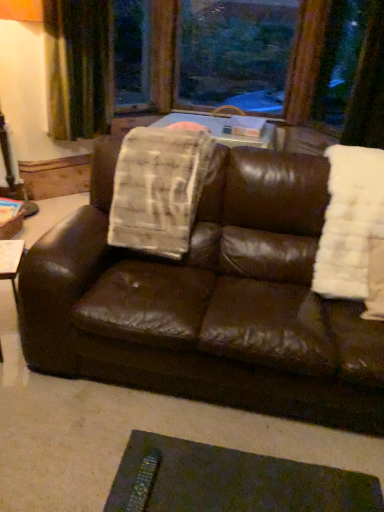
Question: Considering the relative sizes of transparent glass window at upper center, placed as the first window screen when sorted from right to left, and green velvet curtain at upper left in the image provided, is transparent glass window at upper center, placed as the first window screen when sorted from right to left, smaller than green velvet curtain at upper left?

Choices:
 (A) no
 (B) yes

Answer: (A)

Question: Considering the relative positions of transparent glass window at upper center, the second window screen viewed from the left, and green velvet curtain at upper left in the image provided, is transparent glass window at upper center, the second window screen viewed from the left, behind green velvet curtain at upper left?

Choices:
 (A) no
 (B) yes

Answer: (B)

Question: Considering the relative positions of transparent glass window at upper center, placed as the first window screen when sorted from right to left, and green velvet curtain at upper left in the image provided, is transparent glass window at upper center, placed as the first window screen when sorted from right to left, in front of green velvet curtain at upper left?

Choices:
 (A) yes
 (B) no

Answer: (B)

Question: From the image's perspective, is transparent glass window at upper center, the second window screen viewed from the left, on top of green velvet curtain at upper left?

Choices:
 (A) yes
 (B) no

Answer: (A)

Question: Can you confirm if transparent glass window at upper center, placed as the first window screen when sorted from right to left, is shorter than green velvet curtain at upper left?

Choices:
 (A) yes
 (B) no

Answer: (A)

Question: Considering the positions of white fluffy blanket at right, marked as the first blanket in a right-to-left arrangement, and white textured blanket at center, the 1th blanket in the left-to-right sequence, in the image, is white fluffy blanket at right, marked as the first blanket in a right-to-left arrangement, taller or shorter than white textured blanket at center, the 1th blanket in the left-to-right sequence,?

Choices:
 (A) short
 (B) tall

Answer: (B)

Question: From a real-world perspective, is white fluffy blanket at right, marked as the first blanket in a right-to-left arrangement, above or below white textured blanket at center, the 2th blanket from the right?

Choices:
 (A) below
 (B) above

Answer: (A)

Question: From the image's perspective, is white fluffy blanket at right, marked as the first blanket in a right-to-left arrangement, located above or below white textured blanket at center, the 1th blanket in the left-to-right sequence?

Choices:
 (A) below
 (B) above

Answer: (A)

Question: Is white fluffy blanket at right, the second blanket in the left-to-right sequence, situated inside white textured blanket at center, the 2th blanket from the right, or outside?

Choices:
 (A) inside
 (B) outside

Answer: (B)

Question: Based on their positions, is transparent glass window screen at upper center, arranged as the second window screen when viewed from the right, located to the left or right of white textured blanket at center, the 1th blanket in the left-to-right sequence?

Choices:
 (A) left
 (B) right

Answer: (A)

Question: Choose the correct answer: Is transparent glass window screen at upper center, arranged as the second window screen when viewed from the right, inside white textured blanket at center, the 2th blanket from the right, or outside it?

Choices:
 (A) inside
 (B) outside

Answer: (B)

Question: From a real-world perspective, relative to white textured blanket at center, the 2th blanket from the right, is transparent glass window screen at upper center, arranged as the second window screen when viewed from the right, vertically above or below?

Choices:
 (A) below
 (B) above

Answer: (B)

Question: In the image, is transparent glass window screen at upper center, arranged as the second window screen when viewed from the right, positioned in front of or behind white textured blanket at center, the 1th blanket in the left-to-right sequence?

Choices:
 (A) behind
 (B) front

Answer: (A)

Question: From a real-world perspective, relative to metallic textured remote at lower center, is brown leather couch at center vertically above or below?

Choices:
 (A) above
 (B) below

Answer: (A)

Question: Considering the positions of point (102, 248) and point (187, 502), is point (102, 248) closer or farther from the camera than point (187, 502)?

Choices:
 (A) farther
 (B) closer

Answer: (A)